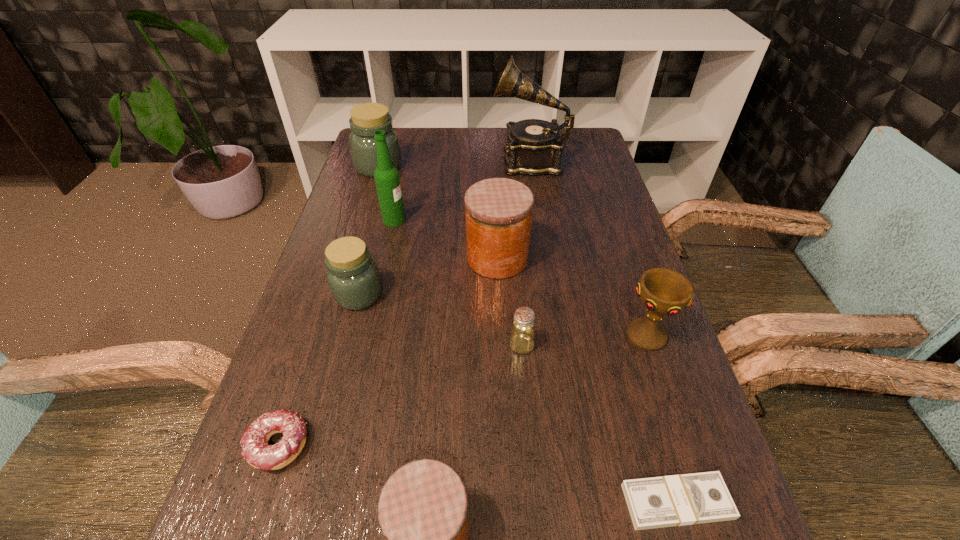
You are a GUI agent. You are given a task and a screenshot of the screen. Output one action in this format:
    pyautogui.click(x=<x>, y=<y>)
    Task: Click on the free space located on the front of the saltshaker
    
    Given the screenshot: What is the action you would take?
    pyautogui.click(x=525, y=387)

This screenshot has height=540, width=960. In order to click on free location located 0.250m on the back of the pink doughnut in this screenshot , I will do `click(324, 309)`.

I want to click on vacant region located on the back of the shortest object, so click(x=632, y=347).

The image size is (960, 540). In order to click on phonograph record located in the far edge section of the desktop in this screenshot , I will do `click(534, 147)`.

Where is `jar present at the far edge`? jar present at the far edge is located at coordinates (367, 118).

At what (x,y) coordinates should I click in order to perform the action: click on beer bottle that is at the left edge. Please return your answer as a coordinate pair (x, y). The height and width of the screenshot is (540, 960). Looking at the image, I should click on (387, 180).

Identify the location of doughnut situated at the left edge. The image size is (960, 540). (256, 451).

The image size is (960, 540). I want to click on phonograph record located at the right edge, so click(534, 147).

This screenshot has height=540, width=960. Find the location of `chalice that is at the right edge`. chalice that is at the right edge is located at coordinates (663, 291).

Locate an element on the screen. This screenshot has height=540, width=960. dollar present at the right edge is located at coordinates (676, 500).